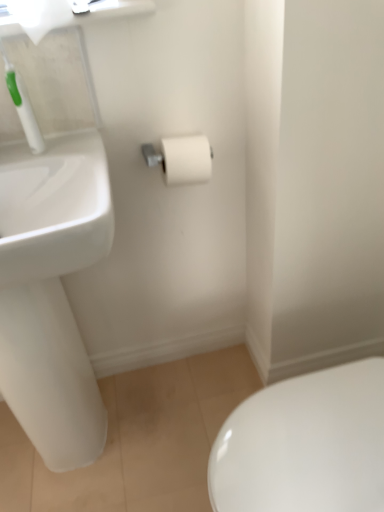
Question: Is white plastic toothbrush at upper left not inside white matte toilet paper at upper left, which appears as the 2th toilet paper when ordered from the bottom?

Choices:
 (A) yes
 (B) no

Answer: (A)

Question: Does white plastic toothbrush at upper left have a smaller size compared to white matte toilet paper at upper left, the 1th toilet paper viewed from the front?

Choices:
 (A) no
 (B) yes

Answer: (B)

Question: Does white plastic toothbrush at upper left appear on the right side of white matte toilet paper at upper left, the 1th toilet paper viewed from the front?

Choices:
 (A) no
 (B) yes

Answer: (A)

Question: Can you confirm if white plastic toothbrush at upper left is shorter than white matte toilet paper at upper left, arranged as the second toilet paper when viewed from the back?

Choices:
 (A) yes
 (B) no

Answer: (B)

Question: Does white plastic toothbrush at upper left have a greater height compared to white matte toilet paper at upper left, the second toilet paper from the right?

Choices:
 (A) no
 (B) yes

Answer: (B)

Question: From the image's perspective, is white plastic toothbrush at upper left over white matte toilet paper at upper left, which appears as the first toilet paper when viewed from the left?

Choices:
 (A) no
 (B) yes

Answer: (A)

Question: Is white matte toilet paper at center, which is the 2th toilet paper from left to right, to the left of white matte toilet paper at upper left, the 1th toilet paper in the top-to-bottom sequence, from the viewer's perspective?

Choices:
 (A) yes
 (B) no

Answer: (B)

Question: Could white matte toilet paper at upper left, the 1th toilet paper viewed from the front, be considered to be inside white matte toilet paper at center, the first toilet paper positioned from the right?

Choices:
 (A) yes
 (B) no

Answer: (B)

Question: From the image's perspective, does white matte toilet paper at center, the 2th toilet paper in the front-to-back sequence, appear lower than white matte toilet paper at upper left, which appears as the first toilet paper when viewed from the left?

Choices:
 (A) yes
 (B) no

Answer: (A)

Question: Is white matte toilet paper at center, marked as the 1th toilet paper in a back-to-front arrangement, wider than white matte toilet paper at upper left, the 1th toilet paper in the top-to-bottom sequence?

Choices:
 (A) yes
 (B) no

Answer: (A)

Question: Is white matte toilet paper at center, marked as the 1th toilet paper in a back-to-front arrangement, bigger than white matte toilet paper at upper left, the 1th toilet paper in the top-to-bottom sequence?

Choices:
 (A) yes
 (B) no

Answer: (B)

Question: Is white matte toilet paper at center, the first toilet paper positioned from the right, smaller than white matte toilet paper at upper left, arranged as the second toilet paper when viewed from the back?

Choices:
 (A) no
 (B) yes

Answer: (B)

Question: Is white matte toilet paper at center, the first toilet paper positioned from the right, outside of white glossy sink at left?

Choices:
 (A) yes
 (B) no

Answer: (A)